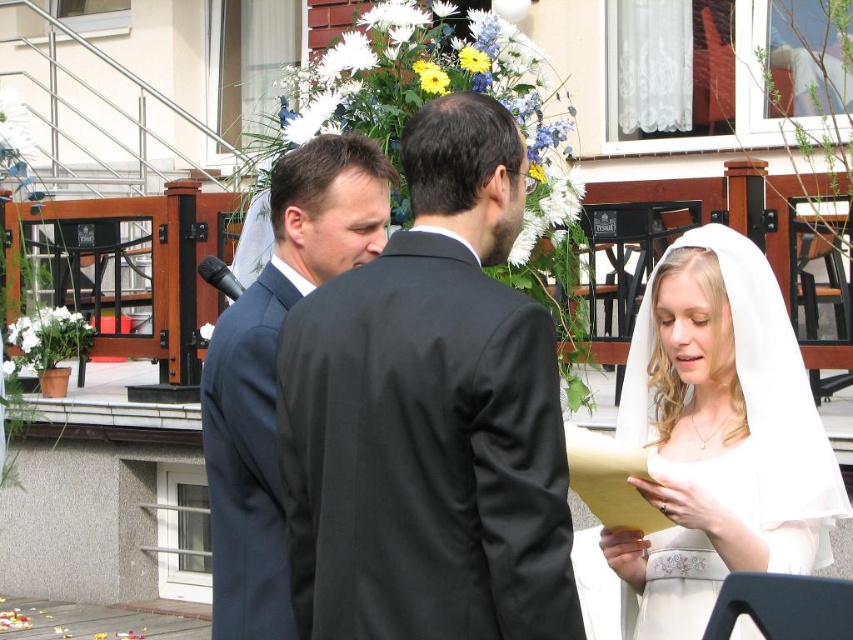
Question: Which object appears closest to the camera in this image?

Choices:
 (A) dark blue suit at center
 (B) matte black suit at center
 (C) white satin veil at upper right
 (D) white sheer veil at lower right

Answer: (B)

Question: Where is matte black suit at center located in relation to white sheer veil at lower right in the image?

Choices:
 (A) below
 (B) above

Answer: (B)

Question: Does matte black suit at center come behind white sheer veil at lower right?

Choices:
 (A) yes
 (B) no

Answer: (B)

Question: Is matte black suit at center wider than white sheer veil at lower right?

Choices:
 (A) yes
 (B) no

Answer: (A)

Question: Which point is farther to the camera?

Choices:
 (A) tap(282, 198)
 (B) tap(422, 211)

Answer: (A)

Question: Which point is farther to the camera?

Choices:
 (A) white sheer veil at lower right
 (B) matte black suit at center

Answer: (A)